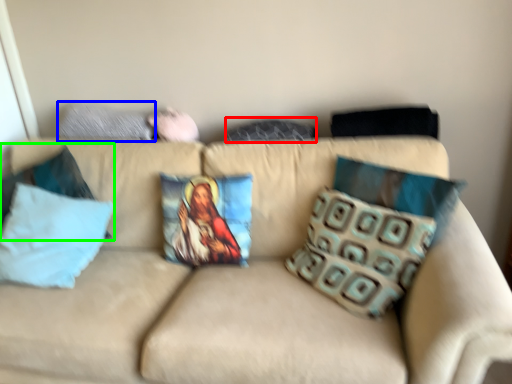
Question: Considering the real-world distances, which object is farthest from pillow (highlighted by a red box)? pillow (highlighted by a blue box) or pillow (highlighted by a green box)?

Choices:
 (A) pillow
 (B) pillow

Answer: (B)